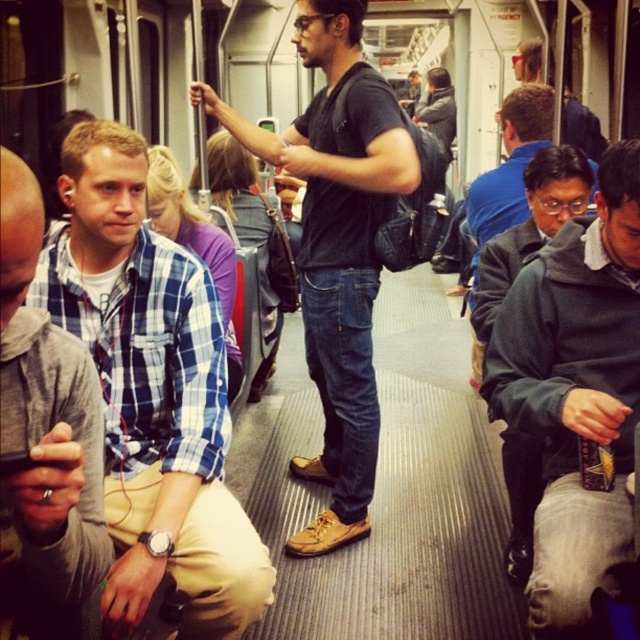
You are standing in the subway car and want to move from the point marked as point (42,474) to the point marked as point (179,189). Can you walk straight ahead without changing direction?

Yes, you can walk straight ahead without changing direction because point (42,474) is in front of point (179,189), meaning there is a direct path between them.

You are a delivery robot in a subway car. You need to navigate between the plaid cotton shirt at left and the plaid cotton shirt at center. The robot is 2 feet wide. Is there enough space between them for you to pass through?

The plaid cotton shirt at left and plaid cotton shirt at center are 5.70 feet apart from each other. Since the robot is 2 feet wide, there is sufficient space to pass through as the distance between them is greater than the robot width.